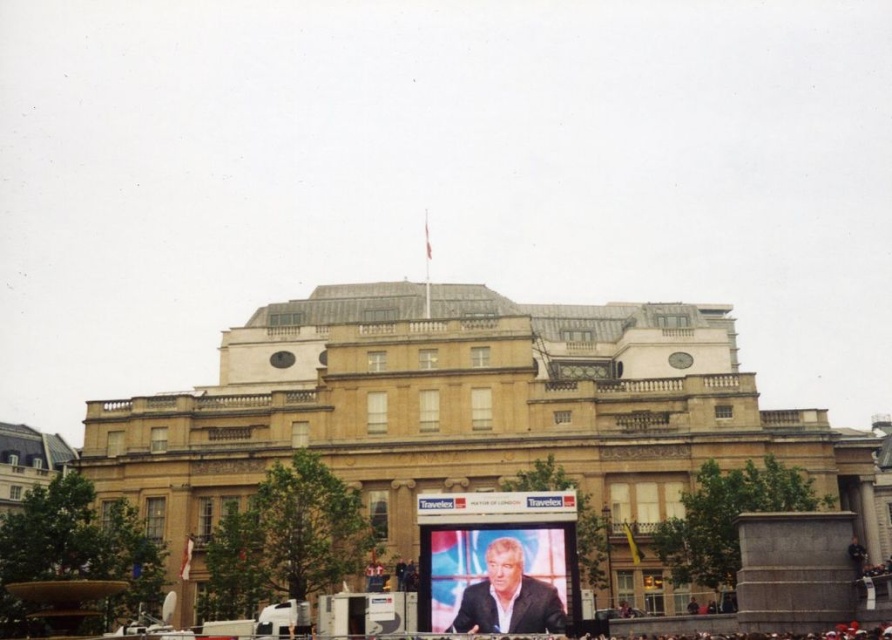
Question: Which point appears closest to the camera in this image?

Choices:
 (A) (402, 433)
 (B) (509, 538)

Answer: (B)

Question: Which point is closer to the camera?

Choices:
 (A) (541, 582)
 (B) (348, 413)

Answer: (A)

Question: Does golden stone palace at center lie in front of suit at center?

Choices:
 (A) yes
 (B) no

Answer: (B)

Question: Does golden stone palace at center have a lesser width compared to suit at center?

Choices:
 (A) yes
 (B) no

Answer: (B)

Question: Is golden stone palace at center to the right of suit at center from the viewer's perspective?

Choices:
 (A) yes
 (B) no

Answer: (A)

Question: Which point is farther from the camera taking this photo?

Choices:
 (A) [562, 612]
 (B) [552, 452]

Answer: (B)